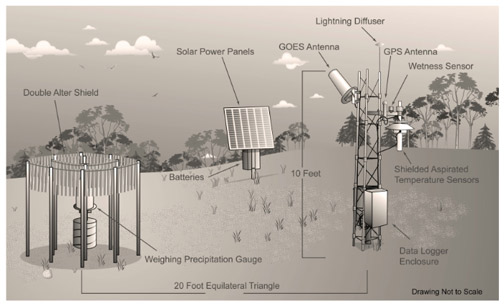
Find the location of a particular element. The height and width of the screenshot is (306, 504). lightning diffuser is located at coordinates click(x=378, y=45).